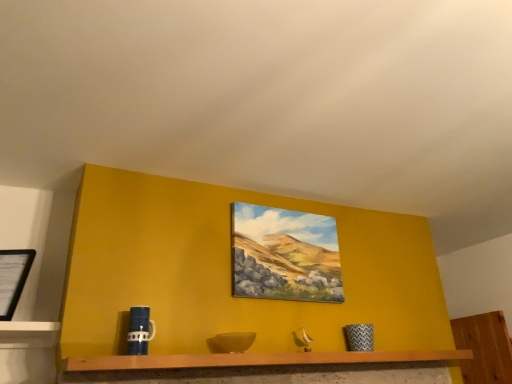
Question: Does blue matte mug at lower left have a greater width compared to black matte picture frame at left, the 1th picture frame viewed from the left?

Choices:
 (A) yes
 (B) no

Answer: (B)

Question: From a real-world perspective, is blue matte mug at lower left beneath black matte picture frame at left, the second picture frame viewed from the back?

Choices:
 (A) no
 (B) yes

Answer: (B)

Question: From the image's perspective, is blue matte mug at lower left under black matte picture frame at left, the first picture frame positioned from the front?

Choices:
 (A) yes
 (B) no

Answer: (A)

Question: From the image's perspective, is blue matte mug at lower left above black matte picture frame at left, acting as the second picture frame starting from the right?

Choices:
 (A) yes
 (B) no

Answer: (B)

Question: Is black matte picture frame at left, the first picture frame positioned from the front, at the back of blue matte mug at lower left?

Choices:
 (A) yes
 (B) no

Answer: (B)

Question: Is wooden shelf at center spatially inside blue matte mug at lower left, or outside of it?

Choices:
 (A) outside
 (B) inside

Answer: (A)

Question: Is wooden shelf at center bigger or smaller than blue matte mug at lower left?

Choices:
 (A) big
 (B) small

Answer: (A)

Question: Visually, is wooden shelf at center positioned to the left or to the right of blue matte mug at lower left?

Choices:
 (A) left
 (B) right

Answer: (B)

Question: From a real-world perspective, is wooden shelf at center positioned above or below blue matte mug at lower left?

Choices:
 (A) above
 (B) below

Answer: (B)

Question: Choose the correct answer: Is blue matte mug at lower left inside matte canvas painting at center, which ranks as the 1th picture frame in right-to-left order, or outside it?

Choices:
 (A) outside
 (B) inside

Answer: (A)

Question: Considering the positions of blue matte mug at lower left and matte canvas painting at center, which is the 2th picture frame from left to right, in the image, is blue matte mug at lower left taller or shorter than matte canvas painting at center, which is the 2th picture frame from left to right,?

Choices:
 (A) short
 (B) tall

Answer: (A)

Question: Is point (142, 319) closer or farther from the camera than point (295, 296)?

Choices:
 (A) closer
 (B) farther

Answer: (A)

Question: In terms of width, does blue matte mug at lower left look wider or thinner when compared to matte canvas painting at center, which ranks as the 1th picture frame in right-to-left order?

Choices:
 (A) thin
 (B) wide

Answer: (B)

Question: Does point (6, 273) appear closer or farther from the camera than point (135, 349)?

Choices:
 (A) closer
 (B) farther

Answer: (B)

Question: From the image's perspective, is black matte picture frame at left, the 1th picture frame viewed from the left, positioned above or below blue matte mug at lower left?

Choices:
 (A) below
 (B) above

Answer: (B)